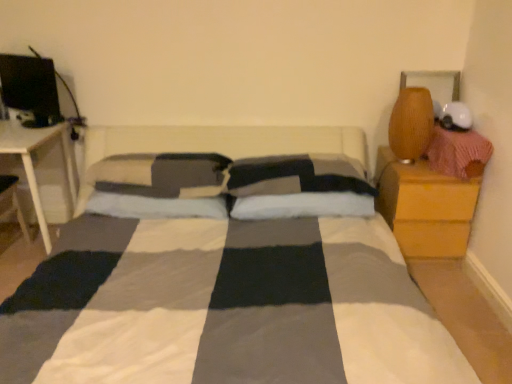
I want to click on free location in front of matte brown vase at upper right, so click(x=418, y=171).